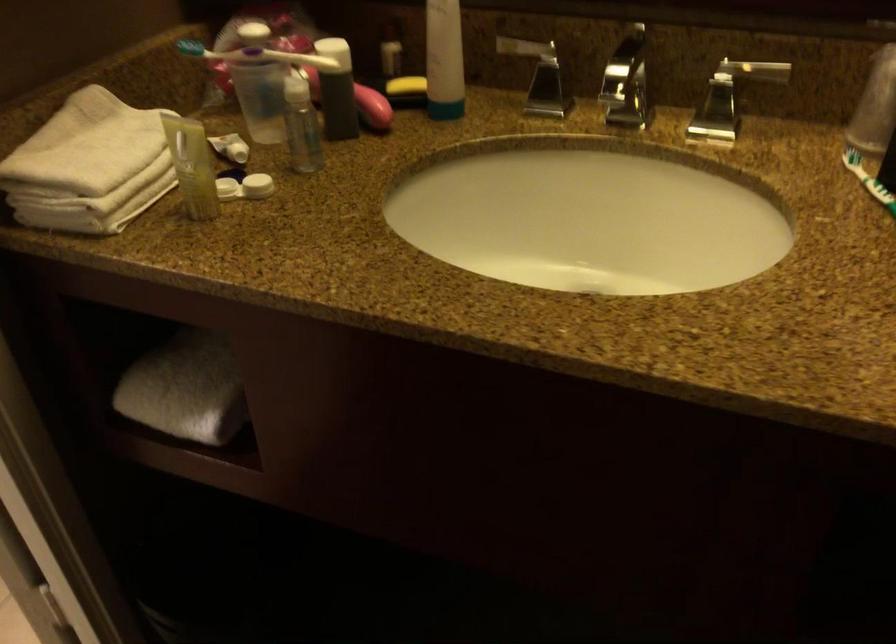
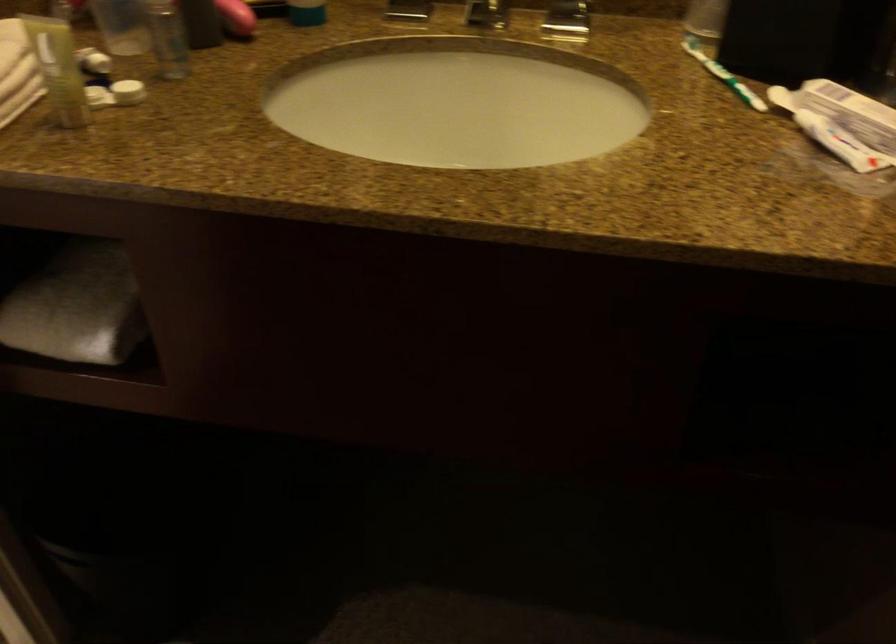
Locate, in the second image, the point that corresponds to (192,384) in the first image.

(76, 306)